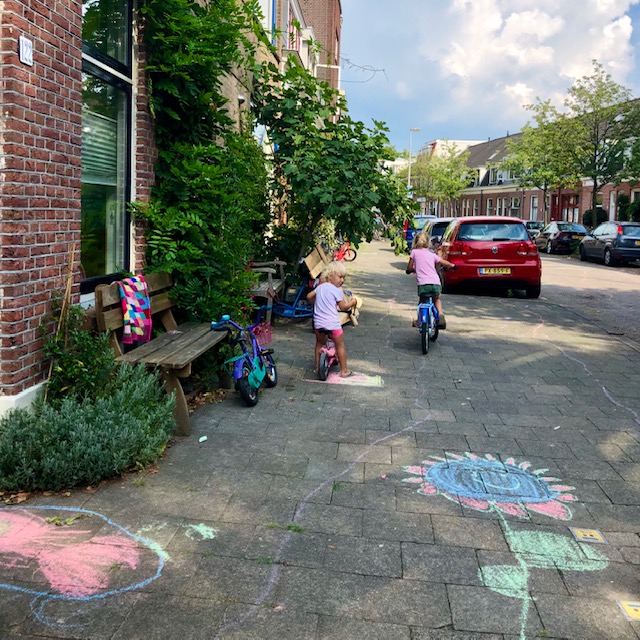
Where is `wooden bench`? wooden bench is located at coordinates (266, 278), (188, 339).